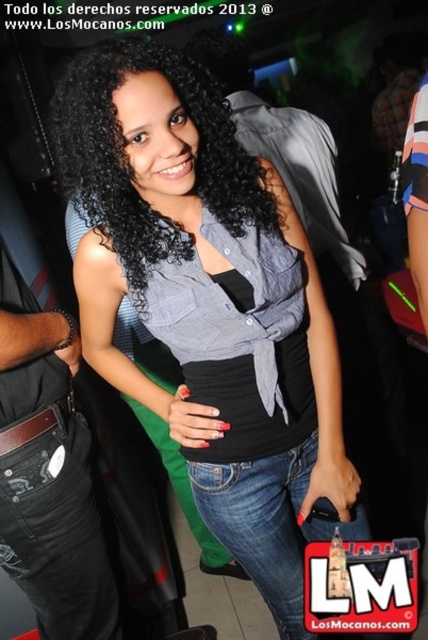
Does point (77, 288) come closer to viewer compared to point (77, 141)?

No, (77, 288) is behind (77, 141).

Who is more distant from viewer, (312, 497) or (92, 136)?

The point (312, 497) is behind.

Who is more forward, (195, 476) or (154, 218)?

Point (154, 218) is more forward.

Where is `denim shirt at center`? The width and height of the screenshot is (428, 640). denim shirt at center is located at coordinates (210, 305).

Is black curly hair at center to the left of gray matte shirt at center from the viewer's perspective?

Indeed, black curly hair at center is positioned on the left side of gray matte shirt at center.

Is point (234, 140) positioned behind point (288, 173)?

No, (234, 140) is closer to viewer.

In order to click on black curly hair at center in this screenshot , I will do `click(127, 161)`.

This screenshot has height=640, width=428. Identify the location of denim shirt at center. (210, 305).

Is the position of denim shirt at center less distant than that of gray matte shirt at center?

Yes.

Who is more forward, (x=308, y=310) or (x=258, y=152)?

Point (x=308, y=310)

Where is `denim shirt at center`? This screenshot has height=640, width=428. denim shirt at center is located at coordinates (210, 305).